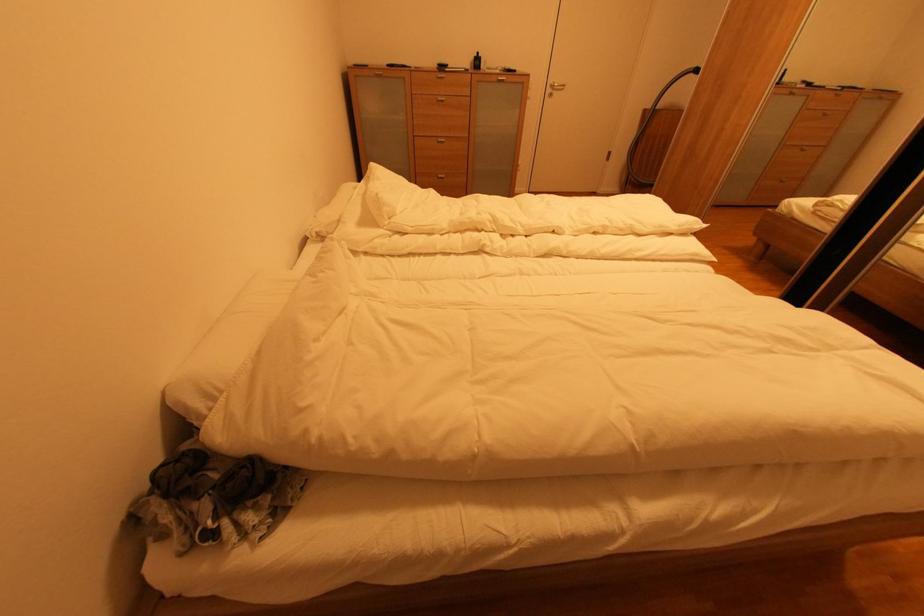
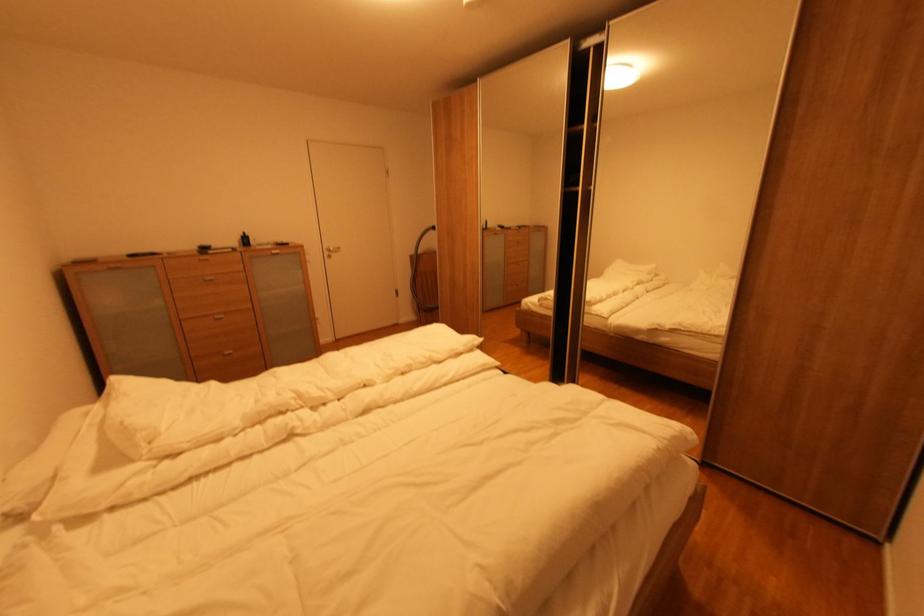
Question: How did the camera likely rotate?

Choices:
 (A) Left
 (B) Right
 (C) Up
 (D) Down

Answer: (B)